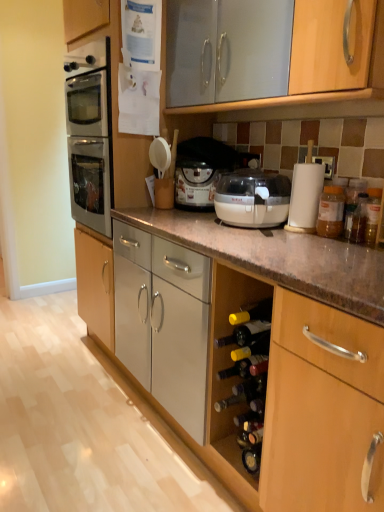
The height and width of the screenshot is (512, 384). Identify the location of translucent plastic jar at right. (331, 212).

Image resolution: width=384 pixels, height=512 pixels. Describe the element at coordinates (253, 348) in the screenshot. I see `translucent yellow glass wine bottle at lower center` at that location.

Describe the element at coordinates (201, 170) in the screenshot. I see `matte white food processor at center` at that location.

The image size is (384, 512). Identify the location of translucent plastic jar at right. (331, 212).

Considering the positions of objects translucent plastic jar at right and matte white food processor at center in the image provided, who is more to the left, translucent plastic jar at right or matte white food processor at center?

Positioned to the left is matte white food processor at center.

Which is closer to the camera, (337,205) or (189,168)?

Point (337,205) is closer to the camera than point (189,168).

Does translucent plastic jar at right turn towards matte white food processor at center?

No, translucent plastic jar at right is not turned towards matte white food processor at center.

Can you confirm if translucent plastic jar at right is bigger than matte white food processor at center?

No.

Considering the points (232, 359) and (214, 172), which point is behind, point (232, 359) or point (214, 172)?

Point (214, 172)

In the scene shown: From a real-world perspective, is translucent yellow glass wine bottle at lower center beneath matte white food processor at center?

Correct, in the physical world, translucent yellow glass wine bottle at lower center is lower than matte white food processor at center.

Between translucent yellow glass wine bottle at lower center and matte white food processor at center, which one has smaller width?

Thinner between the two is translucent yellow glass wine bottle at lower center.

Where is `appliance above the translucent yellow glass wine bottle at lower center (from the image's perspective)`? This screenshot has width=384, height=512. appliance above the translucent yellow glass wine bottle at lower center (from the image's perspective) is located at coordinates (201, 170).

Is matte white food processor at center taller or shorter than translucent yellow glass wine bottle at lower center?

In the image, matte white food processor at center appears to be taller than translucent yellow glass wine bottle at lower center.

Are matte white food processor at center and translucent yellow glass wine bottle at lower center far apart?

No, matte white food processor at center is not far away from translucent yellow glass wine bottle at lower center.

Between point (191, 154) and point (258, 340), which one is positioned behind?

The point (191, 154) is farther.

Which of these two, translucent yellow glass wine bottle at lower center or beige plastic food processor at center, stands taller?

With more height is beige plastic food processor at center.

Is translucent yellow glass wine bottle at lower center positioned far away from beige plastic food processor at center?

They are positioned close to each other.

Is the position of translucent yellow glass wine bottle at lower center less distant than that of beige plastic food processor at center?

Yes.

Where is `kitchen appliance on the right of translucent yellow glass wine bottle at lower center`? The height and width of the screenshot is (512, 384). kitchen appliance on the right of translucent yellow glass wine bottle at lower center is located at coordinates (252, 199).

Considering the positions of points (342, 190) and (277, 201), is point (342, 190) closer to camera compared to point (277, 201)?

Yes, it is.

Would you say translucent plastic jar at right is a long distance from beige plastic food processor at center?

That's not correct — translucent plastic jar at right is a little close to beige plastic food processor at center.

Which of these two, translucent plastic jar at right or beige plastic food processor at center, is wider?

beige plastic food processor at center.

Which object is positioned more to the right, translucent plastic jar at right or beige plastic food processor at center?

translucent plastic jar at right.

From a real-world perspective, which is physically below, beige plastic food processor at center or matte white food processor at center?

In real-world perspective, beige plastic food processor at center is lower.

Which point is more forward, (289,189) or (230,155)?

The point (289,189) is closer to the camera.

Who is bigger, beige plastic food processor at center or matte white food processor at center?

With larger size is matte white food processor at center.

Is beige plastic food processor at center oriented away from matte white food processor at center?

→ No.

Does beige plastic food processor at center have a greater height compared to translucent yellow glass wine bottle at lower center?

Indeed, beige plastic food processor at center has a greater height compared to translucent yellow glass wine bottle at lower center.

Based on the photo, looking at the image, does beige plastic food processor at center seem bigger or smaller compared to translucent yellow glass wine bottle at lower center?

Considering their sizes, beige plastic food processor at center takes up more space than translucent yellow glass wine bottle at lower center.

Identify the location of wine bottle below the beige plastic food processor at center (from a real-world perspective). (253, 348).

This screenshot has height=512, width=384. Identify the location of bottle in front of the matte white food processor at center. (331, 212).

What are the coordinates of `wine bottle on the right of matte white food processor at center` in the screenshot? It's located at (253, 348).

When comparing their distances from matte white food processor at center, does beige plastic food processor at center or translucent yellow glass wine bottle at lower center seem further?

translucent yellow glass wine bottle at lower center lies further to matte white food processor at center than the other object.

Based on their spatial positions, is translucent plastic jar at right or beige plastic food processor at center closer to translucent yellow glass wine bottle at lower center?

translucent plastic jar at right lies closer to translucent yellow glass wine bottle at lower center than the other object.

From the image, which object appears to be farther from beige plastic food processor at center, translucent yellow glass wine bottle at lower center or matte white food processor at center?

The object further to beige plastic food processor at center is translucent yellow glass wine bottle at lower center.

Based on their spatial positions, is translucent plastic jar at right or matte white food processor at center closer to beige plastic food processor at center?

matte white food processor at center lies closer to beige plastic food processor at center than the other object.

Estimate the real-world distances between objects in this image. Which object is further from translucent plastic jar at right, translucent yellow glass wine bottle at lower center or beige plastic food processor at center?

translucent yellow glass wine bottle at lower center is further to translucent plastic jar at right.

Based on their spatial positions, is matte white food processor at center or beige plastic food processor at center further from translucent yellow glass wine bottle at lower center?

matte white food processor at center lies further to translucent yellow glass wine bottle at lower center than the other object.

When comparing their distances from matte white food processor at center, does translucent plastic jar at right or beige plastic food processor at center seem closer?

Based on the image, beige plastic food processor at center appears to be nearer to matte white food processor at center.

When comparing their distances from matte white food processor at center, does translucent yellow glass wine bottle at lower center or beige plastic food processor at center seem closer?

Among the two, beige plastic food processor at center is located nearer to matte white food processor at center.

I want to click on bottle between matte white food processor at center and translucent yellow glass wine bottle at lower center vertically, so click(331, 212).

The image size is (384, 512). I want to click on bottle between beige plastic food processor at center and matte white food processor at center in the front-back direction, so click(331, 212).

At what (x,y) coordinates should I click in order to perform the action: click on bottle that lies between beige plastic food processor at center and translucent yellow glass wine bottle at lower center from top to bottom. Please return your answer as a coordinate pair (x, y). Looking at the image, I should click on (331, 212).

At what (x,y) coordinates should I click in order to perform the action: click on kitchen appliance between matte white food processor at center and translucent yellow glass wine bottle at lower center in the vertical direction. Please return your answer as a coordinate pair (x, y). The height and width of the screenshot is (512, 384). Looking at the image, I should click on (252, 199).